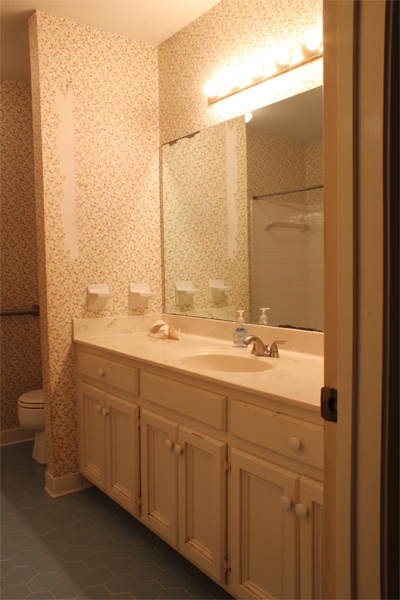
This screenshot has width=400, height=600. Find the location of `cabinet doors`. cabinet doors is located at coordinates (93, 436), (124, 448), (163, 469), (197, 483), (261, 514), (310, 534).